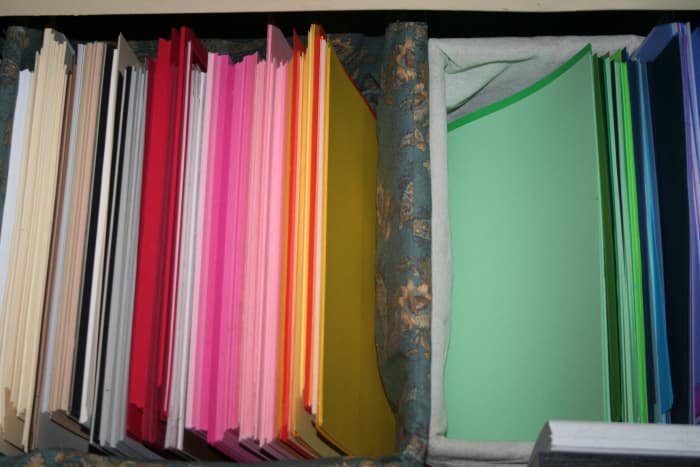
Where is `floral pattern cloth`? Image resolution: width=700 pixels, height=467 pixels. floral pattern cloth is located at coordinates (409, 181).